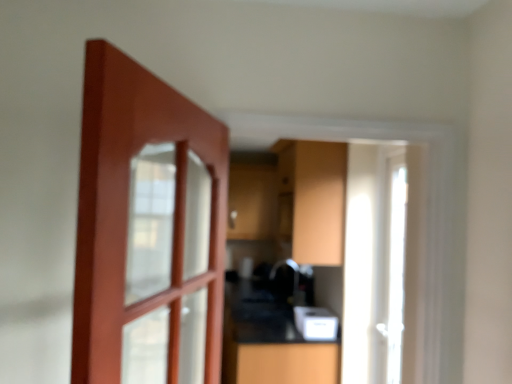
Image resolution: width=512 pixels, height=384 pixels. Describe the element at coordinates (426, 209) in the screenshot. I see `white glossy door at right` at that location.

Where is `matte wood cabinet at center`? Image resolution: width=512 pixels, height=384 pixels. matte wood cabinet at center is located at coordinates (314, 198).

Locate an element on the screen. The height and width of the screenshot is (384, 512). black glossy counter at center is located at coordinates (273, 348).

This screenshot has height=384, width=512. What are the coordinates of `cabinetry located on the right of black glossy counter at center` in the screenshot? It's located at (314, 198).

In the image, is black glossy counter at center positioned in front of or behind matte wood cabinet at center?

Clearly, black glossy counter at center is in front of matte wood cabinet at center.

From the image's perspective, is black glossy counter at center beneath matte wood cabinet at center?

Correct, black glossy counter at center appears lower than matte wood cabinet at center in the image.

Is black glossy counter at center located outside matte wood cabinet at center?

Absolutely, black glossy counter at center is external to matte wood cabinet at center.

Is black glossy counter at center looking in the opposite direction of white glossy door at right?

No, white glossy door at right is not at the back of black glossy counter at center.

Does black glossy counter at center have a larger size compared to white glossy door at right?

Yes, black glossy counter at center is bigger than white glossy door at right.

Are black glossy counter at center and white glossy door at right far apart?

Yes.

Can you confirm if matte wood cabinet at center is thinner than black glossy counter at center?

Yes, matte wood cabinet at center is thinner than black glossy counter at center.

Between matte wood cabinet at center and black glossy counter at center, which one is positioned in front?

black glossy counter at center is closer to the camera.

Where is `counter located on the left of matte wood cabinet at center`? This screenshot has height=384, width=512. counter located on the left of matte wood cabinet at center is located at coordinates (273, 348).

How different are the orientations of matte wood cabinet at center and black glossy counter at center in degrees?

There is a 0.911-degree angle between the facing directions of matte wood cabinet at center and black glossy counter at center.

How different are the orientations of white glossy door at right and black glossy counter at center in degrees?

They differ by 0.166 degrees in their facing directions.

From the image's perspective, which one is positioned lower, white glossy door at right or black glossy counter at center?

From the image's view, black glossy counter at center is below.

The image size is (512, 384). Identify the location of counter on the left of white glossy door at right. (273, 348).

Which object is further away from the camera taking this photo, white glossy door at right or black glossy counter at center?

black glossy counter at center is further away from the camera.

Relative to white plastic toaster at lower center, is white glossy door at right in front or behind?

white glossy door at right is in front of white plastic toaster at lower center.

You are a GUI agent. You are given a task and a screenshot of the screen. Output one action in this format:
    pyautogui.click(x=<x>, y=<y>)
    Task: Click on the appliance located behind the white glossy door at right
    
    Given the screenshot: What is the action you would take?
    pyautogui.click(x=316, y=323)

Is white glossy door at right looking in the opposite direction of white plastic toaster at lower center?

No, white glossy door at right's orientation is not away from white plastic toaster at lower center.

Is white glossy door at right surrounding white plastic toaster at lower center?

No, white plastic toaster at lower center is not a part of white glossy door at right.

Which is more to the right, matte wood cabinet at center or white plastic toaster at lower center?

white plastic toaster at lower center.

Does matte wood cabinet at center have a larger size compared to white plastic toaster at lower center?

Indeed, matte wood cabinet at center has a larger size compared to white plastic toaster at lower center.

What are the coordinates of `cabinetry located on the left of white plastic toaster at lower center` in the screenshot? It's located at (314, 198).

Which is nearer, (296,194) or (315,315)?

Point (296,194).

From the picture: Which is more to the right, white plastic toaster at lower center or white glossy door at right?

white glossy door at right.

Can white glossy door at right be found inside white plastic toaster at lower center?

Definitely not — white glossy door at right is not inside white plastic toaster at lower center.

From the image's perspective, is white plastic toaster at lower center on top of white glossy door at right?

No, from the image's perspective, white plastic toaster at lower center is not above white glossy door at right.

Where is `cabinetry on the right of black glossy counter at center`? cabinetry on the right of black glossy counter at center is located at coordinates (314, 198).

Find the location of a particular element. Image resolution: width=512 pixels, height=384 pixels. window frame that is in front of the black glossy counter at center is located at coordinates (426, 209).

Looking at the image, which one is located closer to black glossy counter at center, white glossy door at right or white plastic toaster at lower center?

Based on the image, white plastic toaster at lower center appears to be nearer to black glossy counter at center.

From the image, which object appears to be farther from black glossy counter at center, white glossy door at right or matte wood cabinet at center?

white glossy door at right is further to black glossy counter at center.

Which object lies nearer to the anchor point white glossy door at right, black glossy counter at center or matte wood cabinet at center?

matte wood cabinet at center.

Looking at this image, which object lies nearer to the anchor point white plastic toaster at lower center, black glossy counter at center or matte wood cabinet at center?

black glossy counter at center lies closer to white plastic toaster at lower center than the other object.

Based on their spatial positions, is black glossy counter at center or white glossy door at right further from white plastic toaster at lower center?

The object further to white plastic toaster at lower center is white glossy door at right.

Looking at the image, which one is located closer to white glossy door at right, white plastic toaster at lower center or black glossy counter at center?

white plastic toaster at lower center is closer to white glossy door at right.

Considering their positions, is matte wood cabinet at center positioned closer to white glossy door at right than white plastic toaster at lower center?

matte wood cabinet at center is closer to white glossy door at right.

Based on their spatial positions, is white plastic toaster at lower center or white glossy door at right further from matte wood cabinet at center?

Among the two, white glossy door at right is located further to matte wood cabinet at center.

In order to click on cabinetry between white glossy door at right and white plastic toaster at lower center in the front-back direction in this screenshot , I will do `click(314, 198)`.

Locate an element on the screen. This screenshot has height=384, width=512. appliance between matte wood cabinet at center and black glossy counter at center from top to bottom is located at coordinates (316, 323).

Find the location of a particular element. Image resolution: width=512 pixels, height=384 pixels. window frame between matte wood cabinet at center and black glossy counter at center in the vertical direction is located at coordinates (426, 209).

The width and height of the screenshot is (512, 384). I want to click on appliance between white glossy door at right and black glossy counter at center in the up-down direction, so click(x=316, y=323).